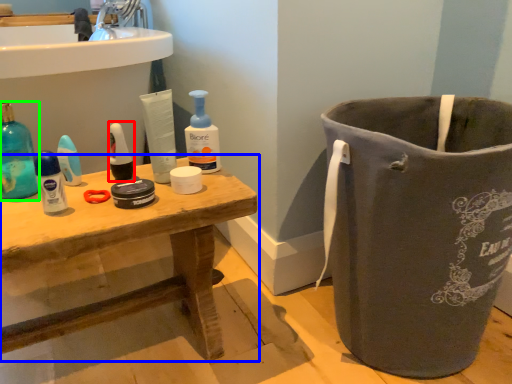
Question: Estimate the real-world distances between objects in this image. Which object is closer to mouthwash (highlighted by a red box), table (highlighted by a blue box) or cleaning product (highlighted by a green box)?

Choices:
 (A) table
 (B) cleaning product

Answer: (B)